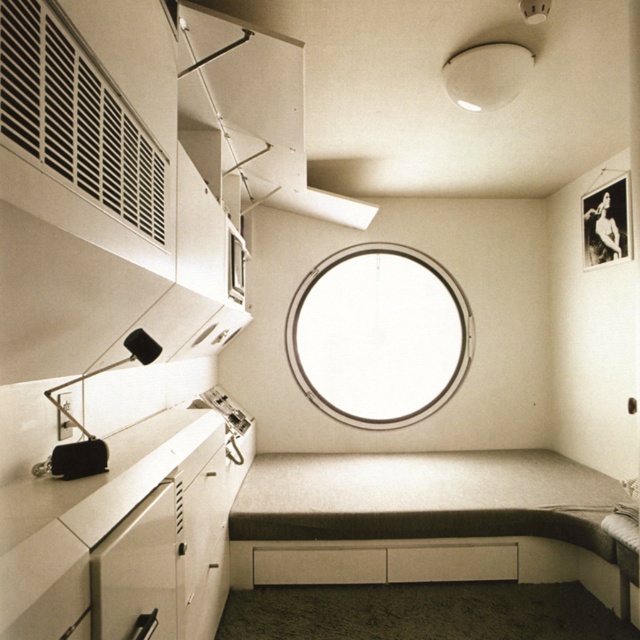
Question: Which object appears farthest from the camera in this image?

Choices:
 (A) matte black lamp at left
 (B) white glass window at center
 (C) transparent glass window at center

Answer: (B)

Question: Can you confirm if white glass window at center is wider than transparent glass window at center?

Choices:
 (A) yes
 (B) no

Answer: (A)

Question: Among these objects, which one is farthest from the camera?

Choices:
 (A) white matte lampshade at upper center
 (B) transparent glass window at center
 (C) black vent at upper left

Answer: (B)

Question: In this image, where is black vent at upper left located relative to transparent glass window at center?

Choices:
 (A) right
 (B) left

Answer: (A)

Question: Is black vent at upper left bigger than matte black lamp at left?

Choices:
 (A) no
 (B) yes

Answer: (A)

Question: Among these points, which one is farthest from the camera?

Choices:
 (A) (13, 10)
 (B) (397, 314)

Answer: (B)